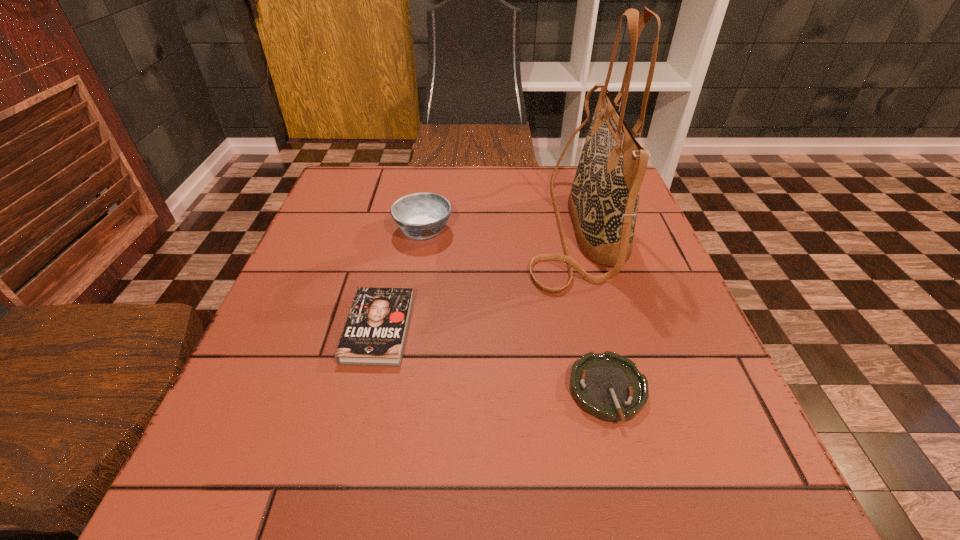
Find the location of a particular element. This screenshot has width=960, height=540. free spot located on the front of the book is located at coordinates (360, 414).

Identify the location of vacant space located 0.120m on the front of the shorter ashtray. The height and width of the screenshot is (540, 960). (638, 512).

Identify the location of handbag that is at the far edge. (603, 202).

Locate an element on the screen. Image resolution: width=960 pixels, height=540 pixels. ashtray that is at the far edge is located at coordinates (421, 215).

The image size is (960, 540). Find the location of `object present at the left edge`. object present at the left edge is located at coordinates (375, 332).

Locate an element on the screen. This screenshot has width=960, height=540. handbag that is at the right edge is located at coordinates (603, 202).

Find the location of `ashtray that is at the right edge`. ashtray that is at the right edge is located at coordinates (608, 386).

Find the location of a particular element. Image resolution: width=960 pixels, height=540 pixels. object that is at the far right corner is located at coordinates (603, 202).

The height and width of the screenshot is (540, 960). Find the location of `vacant region at the far edge of the desktop`. vacant region at the far edge of the desktop is located at coordinates (411, 174).

In the image, there is a desktop. Identify the location of vacant region at the near edge. (360, 460).